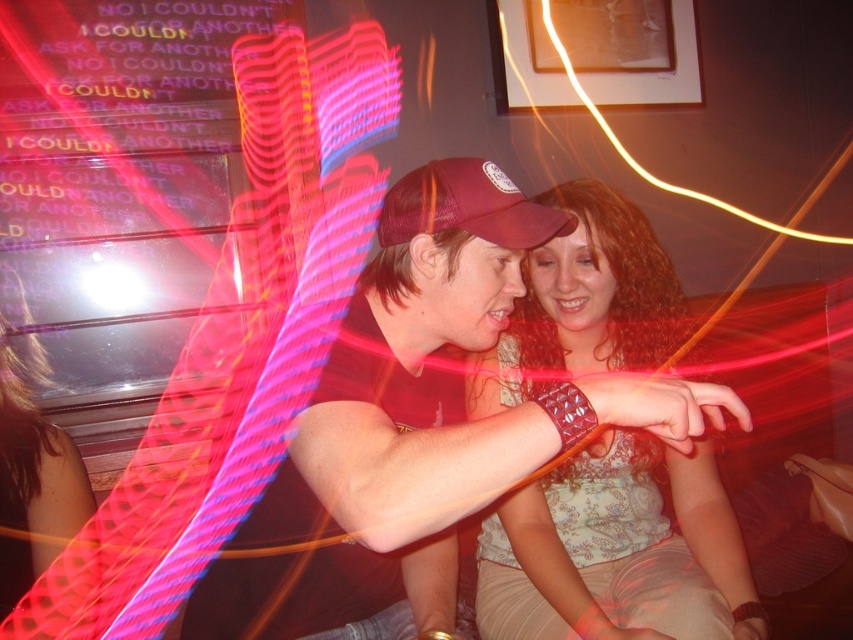
Question: Which object is positioned farthest from the light blue floral blouse at center?

Choices:
 (A) matte black dress at lower left
 (B) maroon mesh baseball cap at center

Answer: (A)

Question: Which point is farther to the camera?

Choices:
 (A) (1, 358)
 (B) (566, 534)
 (C) (489, 202)

Answer: (B)

Question: Does light blue floral blouse at center lie in front of matte black dress at lower left?

Choices:
 (A) no
 (B) yes

Answer: (B)

Question: Which point appears farthest from the camera in this image?

Choices:
 (A) (444, 228)
 (B) (596, 216)
 (C) (33, 486)

Answer: (B)

Question: From the image, what is the correct spatial relationship of light blue floral blouse at center in relation to matte black dress at lower left?

Choices:
 (A) left
 (B) right

Answer: (B)

Question: Can you confirm if light blue floral blouse at center is wider than maroon mesh baseball cap at center?

Choices:
 (A) yes
 (B) no

Answer: (A)